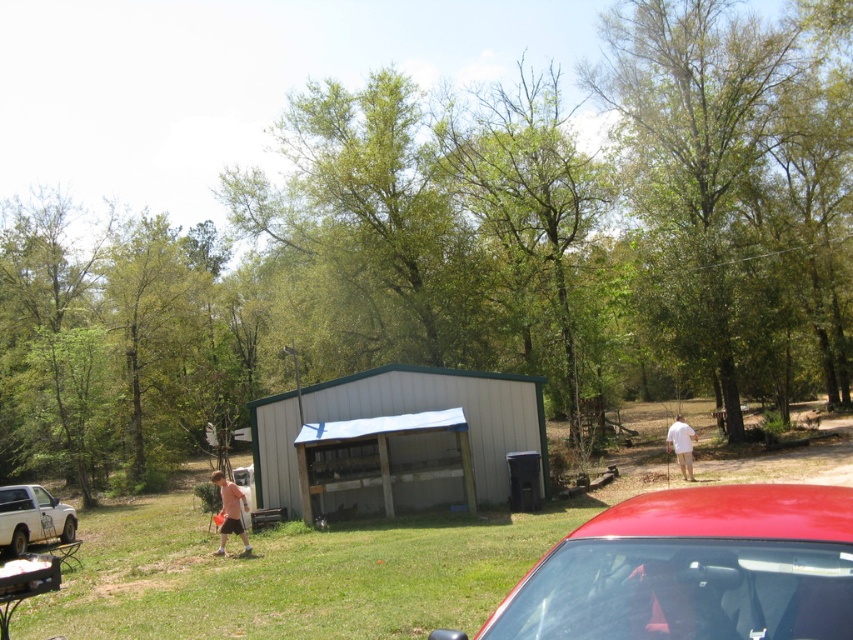
Question: Which is farther from the matte pink shorts at center?

Choices:
 (A) white matte truck at lower left
 (B) white cotton shirt at center-right

Answer: (B)

Question: Is shiny red car at lower right thinner than white matte truck at lower left?

Choices:
 (A) yes
 (B) no

Answer: (B)

Question: Among these points, which one is farthest from the camera?

Choices:
 (A) (219, 540)
 (B) (705, 538)
 (C) (677, 436)

Answer: (C)

Question: Which object is positioned closest to the shiny red car at lower right?

Choices:
 (A) white cotton shirt at center-right
 (B) gray metal shed at center
 (C) white matte truck at lower left

Answer: (B)

Question: Can you confirm if white matte truck at lower left is positioned above matte pink shorts at center?

Choices:
 (A) no
 (B) yes

Answer: (A)

Question: Is shiny red car at lower right wider than gray metal shed at center?

Choices:
 (A) no
 (B) yes

Answer: (B)